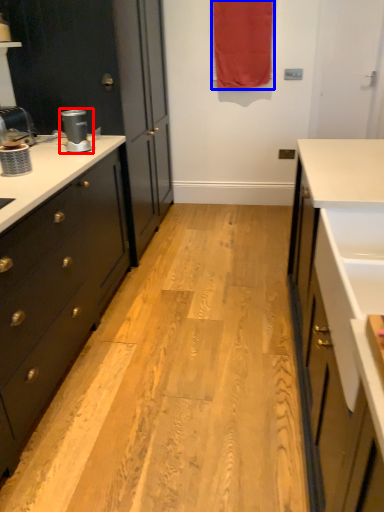
Question: Which of the following is the closest to the observer, coffee machine (highlighted by a red box) or curtain (highlighted by a blue box)?

Choices:
 (A) coffee machine
 (B) curtain

Answer: (A)